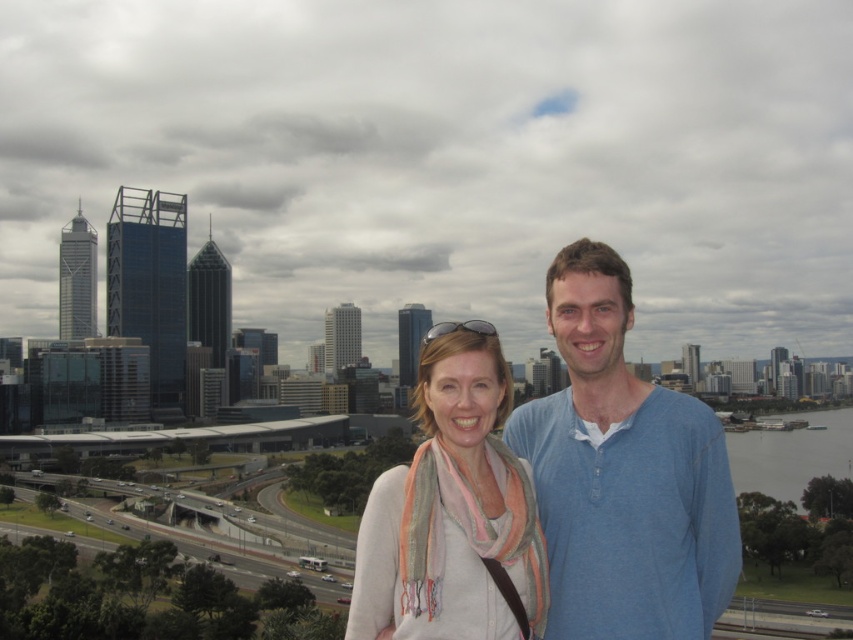
Is point (654, 573) farther from viewer compared to point (498, 397)?

No, it is not.

Between blue cotton shirt at center and white soft scarf at center, which one appears on the left side from the viewer's perspective?

Positioned to the left is white soft scarf at center.

Is point (666, 456) positioned in front of point (463, 472)?

Yes, it is.

The height and width of the screenshot is (640, 853). What are the coordinates of `blue cotton shirt at center` in the screenshot? It's located at (624, 474).